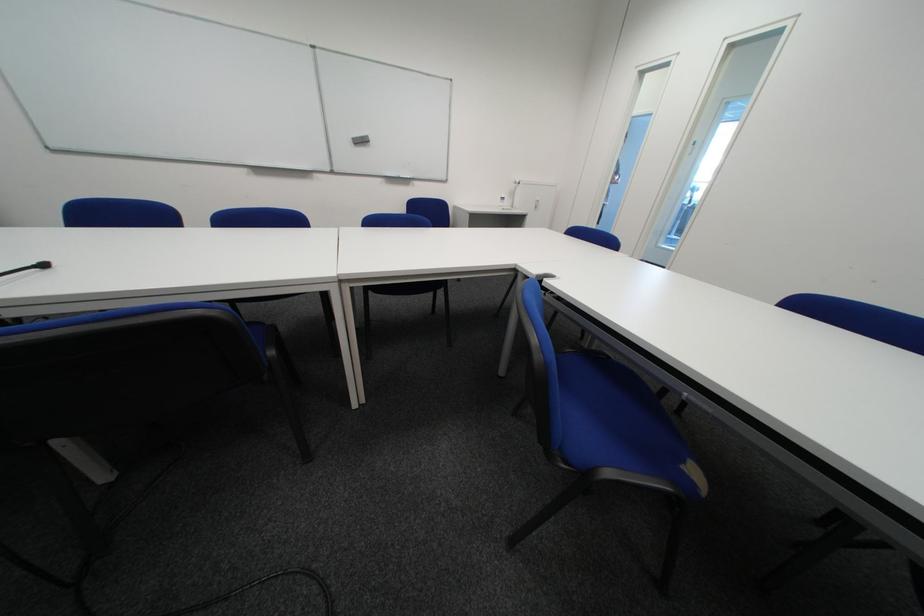
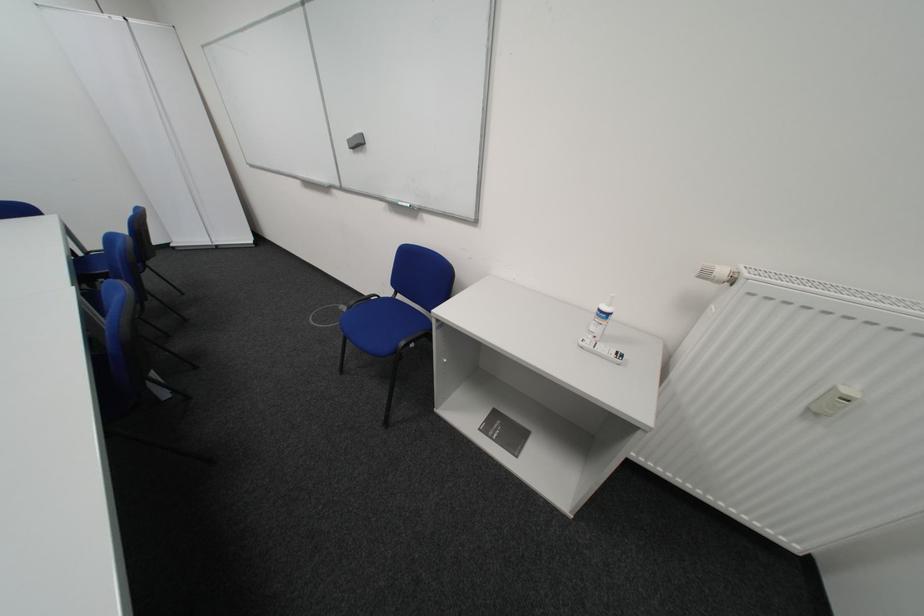
Locate, in the second image, the point that corresponds to (516,209) in the first image.

(599, 345)